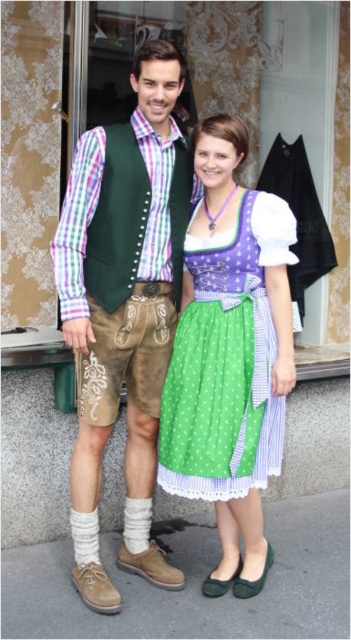
You are a tailor who needs to decide which item to hang first in a vertical display. The leather vest at center and the matte black apron at center are both on the same rack. Based on their sizes, which one should you hang higher to ensure proper visibility?

The leather vest at center is much taller than the matte black apron at center, so you should hang the leather vest at center higher to ensure it doesn not block the view of the shorter apron.

You are standing in front of the store and want to take a photo of the leather vest at center. Your camera is 7.40 feet away from the vest. Is the camera close enough to capture the vest clearly?

The leather vest at center and camera are 7.40 feet apart, so the camera is close enough to capture the vest clearly.